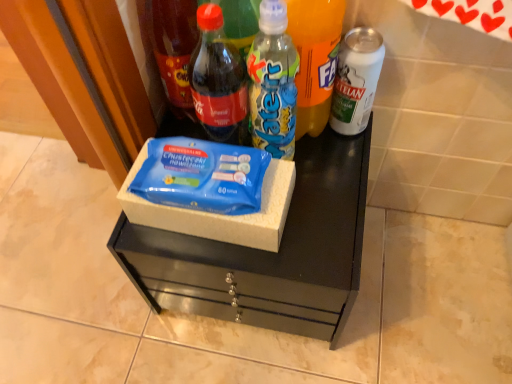
Locate an element on the screen. blank space situated above blue matte wipes at center (from a real-world perspective) is located at coordinates (297, 199).